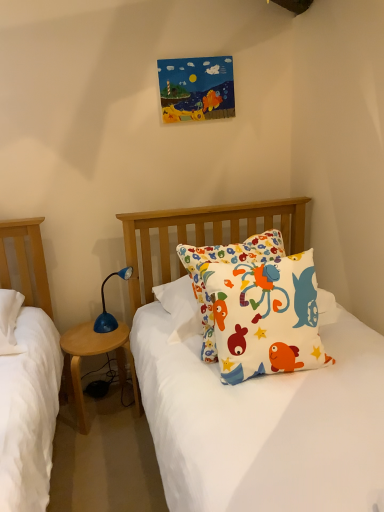
The width and height of the screenshot is (384, 512). Find the location of `free location to the left of blue plastic lamp at lower left`. free location to the left of blue plastic lamp at lower left is located at coordinates (83, 336).